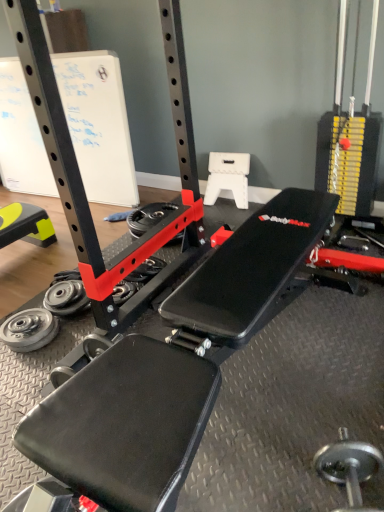
Where is `free space above silver metallic weight plate at lower left, the 1th wheel in the bottom-to-top sequence (from a real-world perspective)`? This screenshot has width=384, height=512. free space above silver metallic weight plate at lower left, the 1th wheel in the bottom-to-top sequence (from a real-world perspective) is located at coordinates (25, 335).